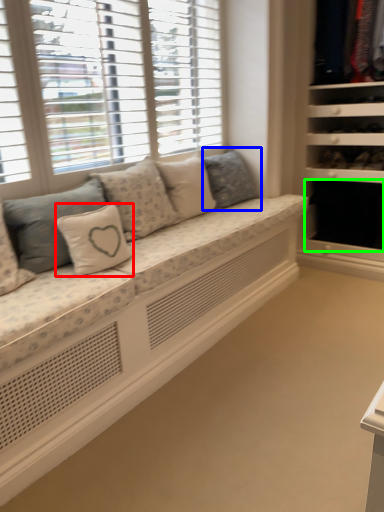
Question: Which object is positioned closest to pillow (highlighted by a red box)? Select from pillow (highlighted by a blue box) and shelf (highlighted by a green box).

Choices:
 (A) pillow
 (B) shelf

Answer: (A)